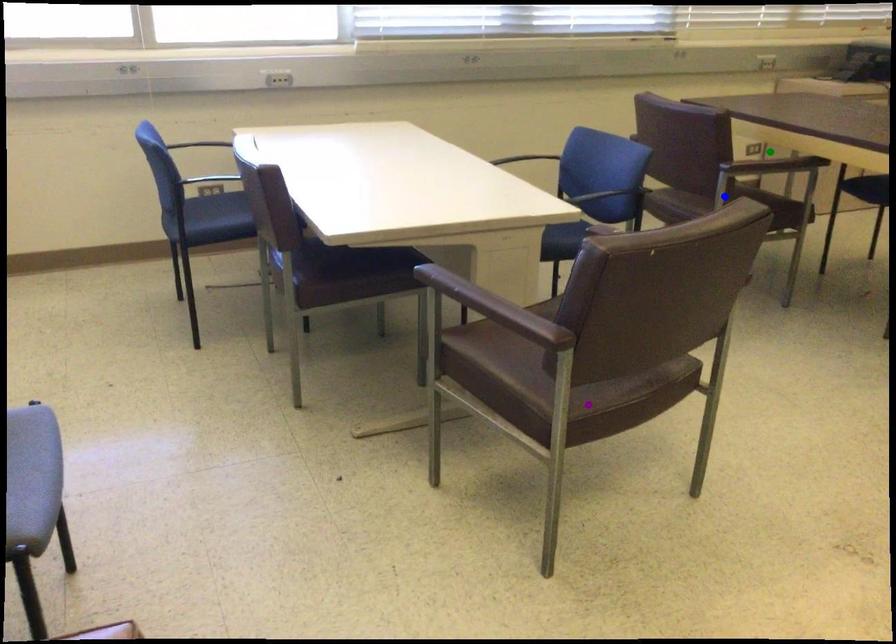
Order these from nearest to farthest:
purple point, green point, blue point

purple point, blue point, green point